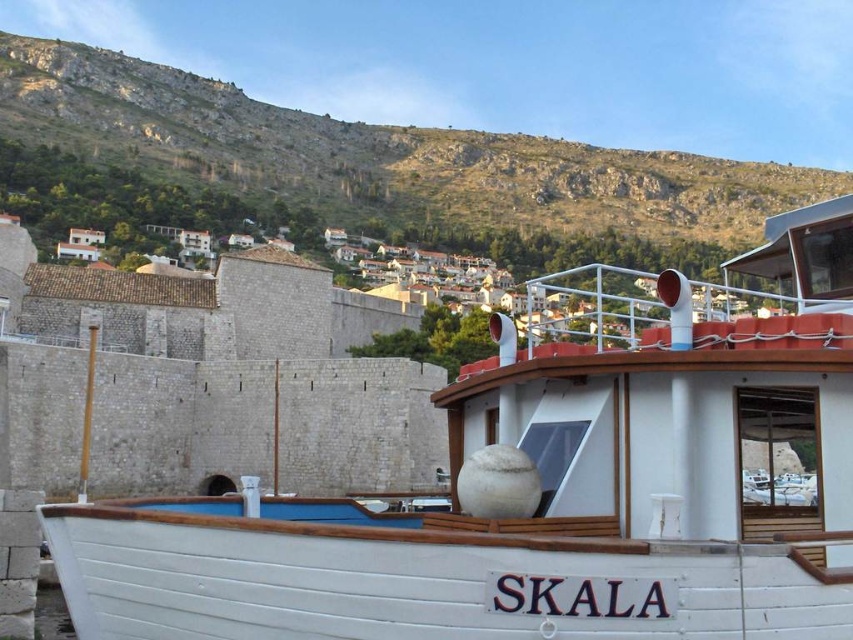
You are planning to place a new bench next to the white wooden boat at center. Considering the boat is narrower than the green grassy hillside at upper center, can the bench be placed on the boat without overlapping it?

The white wooden boat at center is narrower than the green grassy hillside at upper center. However, the bench should be placed on the boat itself, not comparing to the hillside. Since the boat is narrower, the bench must be sized appropriately to fit within its width.

You are a photographer planning to take a wide shot of the coastal scene. The white wooden boat at center and the green grassy hillside at upper center are both in your frame. Which object will occupy more of the photo? Please explain your reasoning based on their sizes in the image.

The green grassy hillside at upper center occupies more space in the photo than the white wooden boat at center because the white wooden boat at center occupies less space than green grassy hillside at upper center according to the description.